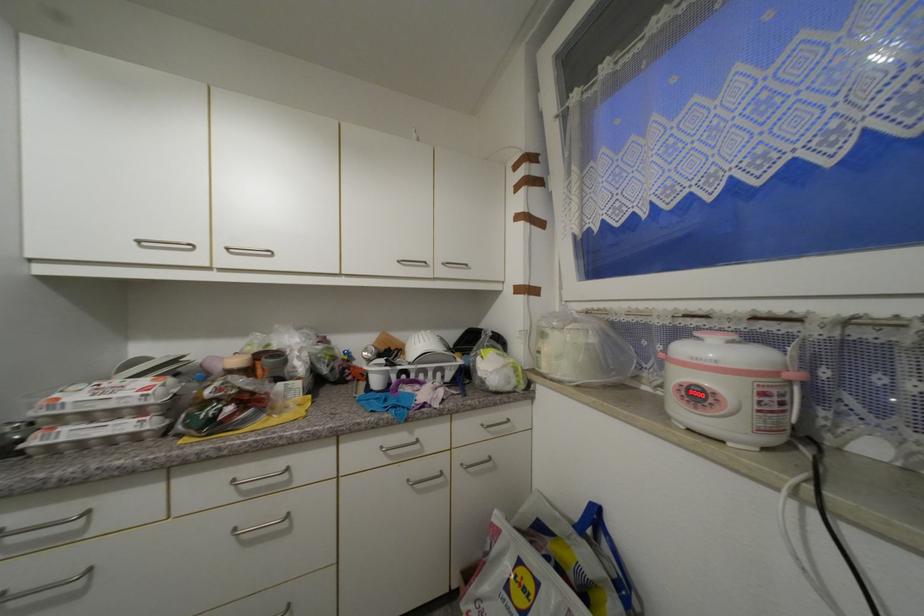
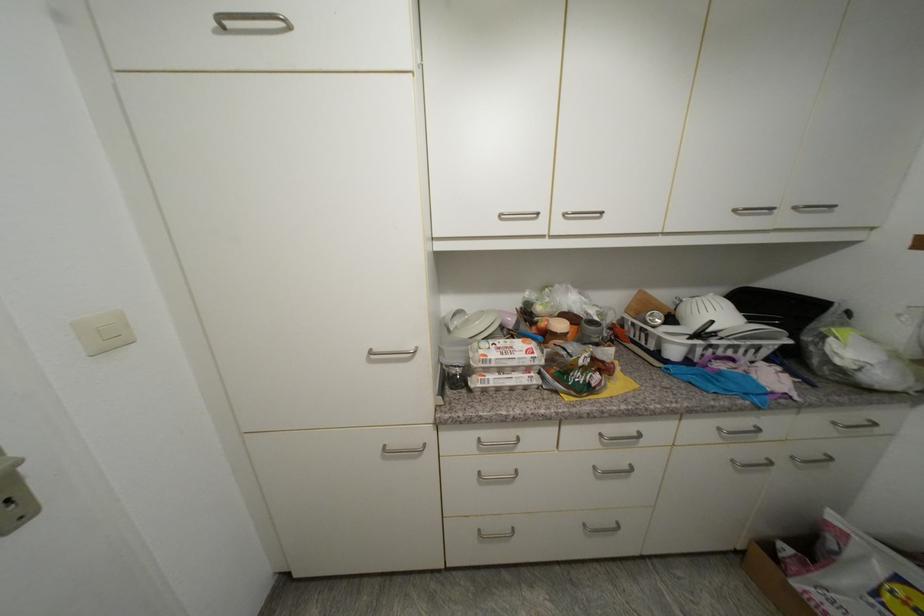
The point at (405, 262) is marked in the first image. Where is the corresponding point in the second image?

(740, 213)